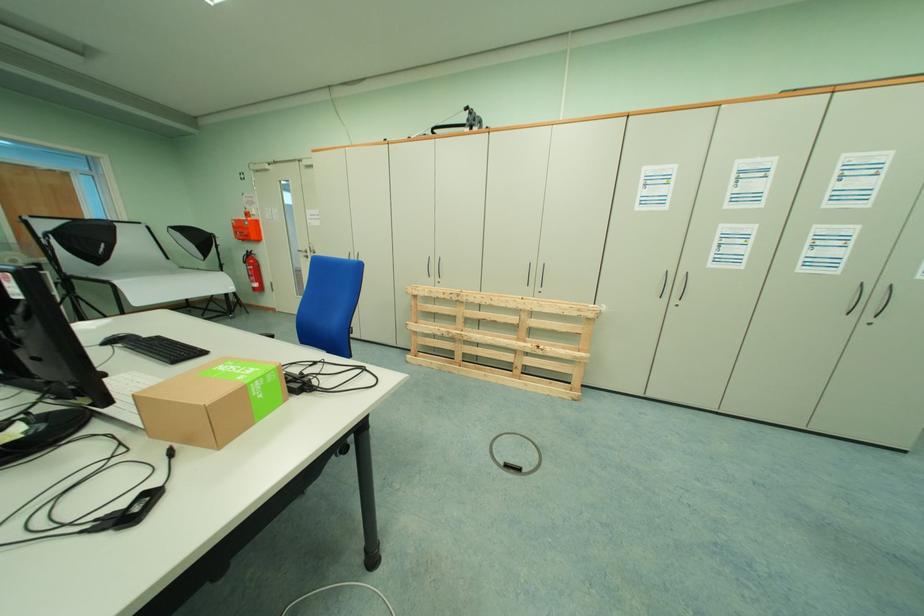
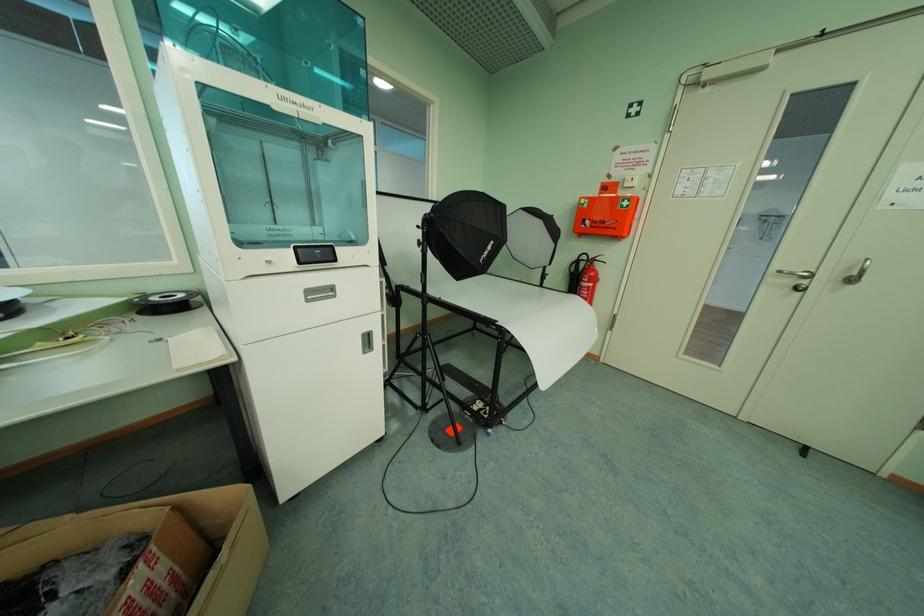
Based on the photo, in a continuous first-person perspective shot, in which direction is the camera moving?

The movement direction of the cameraman is left, forward.